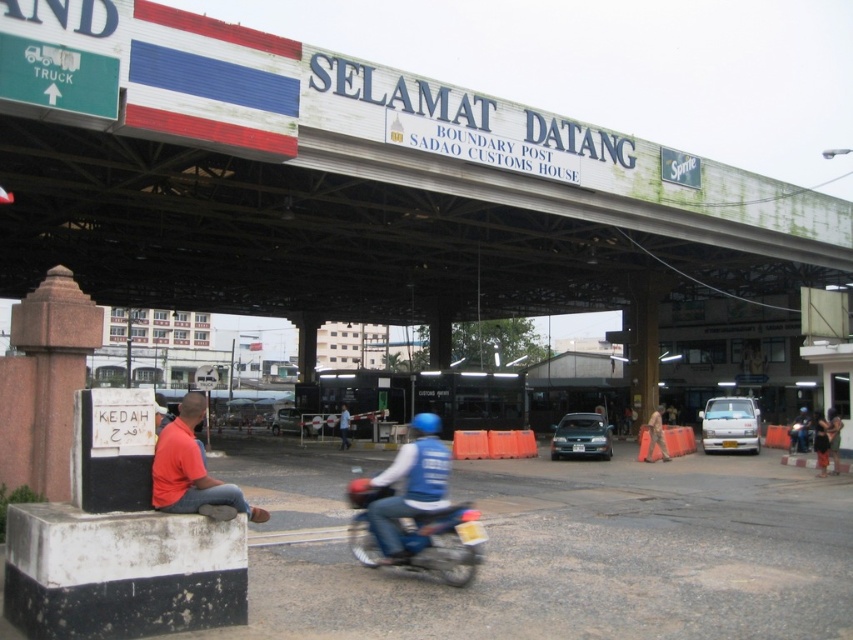
You are a traveler approaching the Sadao Customs House. You see a white painted steel at upper center and a metallic blue motorcycle at center. Which object is positioned higher relative to the other?

The white painted steel at upper center is located above the metallic blue motorcycle at center, so it is positioned higher.

You are a customs officer at the Sadao Customs House. You need to direct a vehicle to park in a specific spot. The metallic blue motorcycle at center is currently blocking the path. Can you move it to the area near the dark blue jeans at lower right without needing to widen the space?

The metallic blue motorcycle at center occupies less space than the dark blue jeans at lower right. Since the motorcycle takes up less space, it can be moved to the area near the dark blue jeans at lower right without requiring additional space.